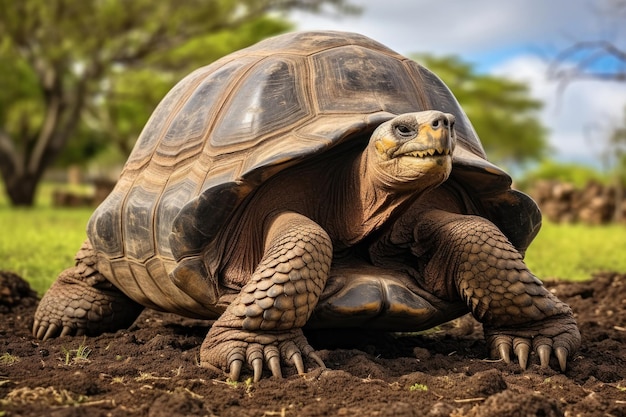
Where is `right front leg`? The height and width of the screenshot is (417, 626). right front leg is located at coordinates (279, 272).